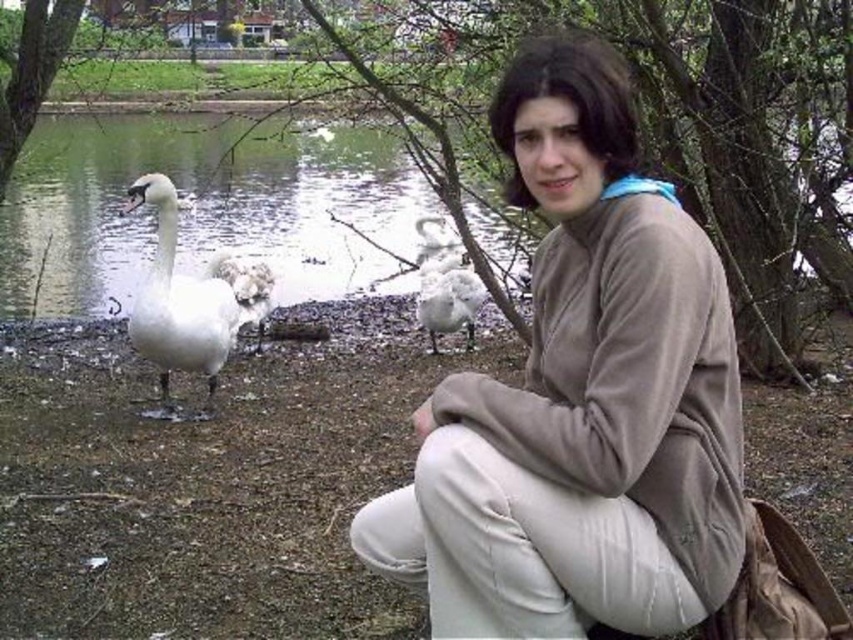
Does white glossy water at left have a lesser height compared to white fluffy goose at center?

No.

Is white glossy water at left wider than white fluffy goose at center?

Indeed, white glossy water at left has a greater width compared to white fluffy goose at center.

You are a GUI agent. You are given a task and a screenshot of the screen. Output one action in this format:
    pyautogui.click(x=<x>, y=<y>)
    Task: Click on the white glossy water at left
    This screenshot has height=640, width=853.
    Given the screenshot: What is the action you would take?
    pyautogui.click(x=202, y=205)

At what (x,y) coordinates should I click in order to perform the action: click on white glossy water at left. Please return your answer as a coordinate pair (x, y). Image resolution: width=853 pixels, height=640 pixels. Looking at the image, I should click on (202, 205).

Can you confirm if matte brown sweater at center is smaller than white glossy swan at left?

Correct, matte brown sweater at center occupies less space than white glossy swan at left.

What are the coordinates of `matte brown sweater at center` in the screenshot? It's located at (581, 397).

The height and width of the screenshot is (640, 853). In order to click on matte brown sweater at center in this screenshot , I will do `click(581, 397)`.

Does white fluffy goose at center appear on the right side of white fluffy goose at left?

Yes, white fluffy goose at center is to the right of white fluffy goose at left.

Who is more distant from viewer, (421,308) or (235,275)?

The point (421,308) is more distant.

Between point (438, 307) and point (244, 292), which one is positioned in front?

Point (244, 292) is in front.

The image size is (853, 640). Find the location of `white fluffy goose at center`. white fluffy goose at center is located at coordinates (445, 284).